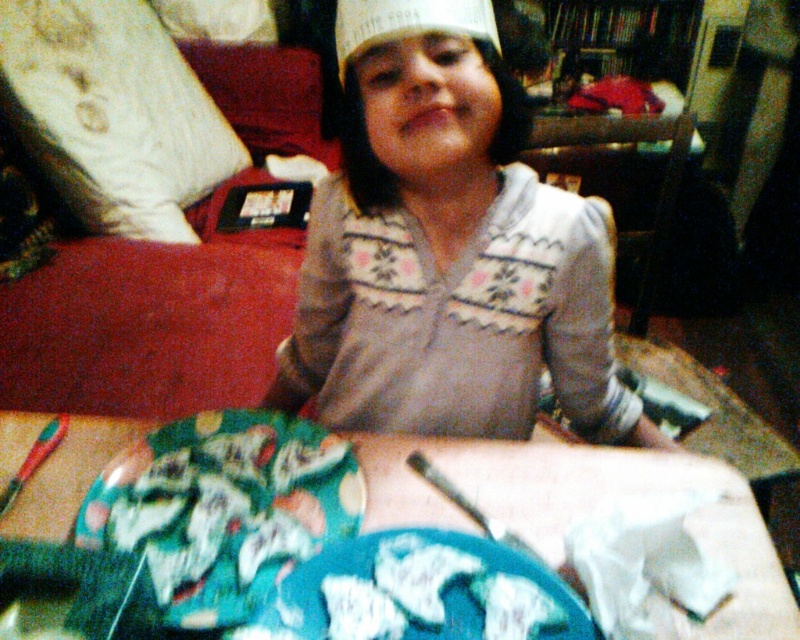
Between wooden table at center and white paper hat at center, which one is positioned higher?

white paper hat at center

Which is in front, point (560, 460) or point (432, 28)?

Positioned in front is point (432, 28).

You are a GUI agent. You are given a task and a screenshot of the screen. Output one action in this format:
    pyautogui.click(x=<x>, y=<y>)
    Task: Click on the wooden table at center
    The width and height of the screenshot is (800, 640).
    Given the screenshot: What is the action you would take?
    pyautogui.click(x=540, y=502)

Is wooden table at center to the right of floral paper plate at lower center from the viewer's perspective?

Correct, you'll find wooden table at center to the right of floral paper plate at lower center.

Based on the photo, who is positioned more to the right, wooden table at center or floral paper plate at lower center?

From the viewer's perspective, wooden table at center appears more on the right side.

Locate an element on the screen. wooden table at center is located at coordinates (540, 502).

In order to click on wooden table at center in this screenshot , I will do `click(540, 502)`.

Between point (274, 467) and point (260, 632), which one is positioned behind?

The point (274, 467) is behind.

Which is in front, point (132, 460) or point (306, 582)?

Point (306, 582) is more forward.

Where is `floral paper plate at lower center`? The image size is (800, 640). floral paper plate at lower center is located at coordinates (224, 508).